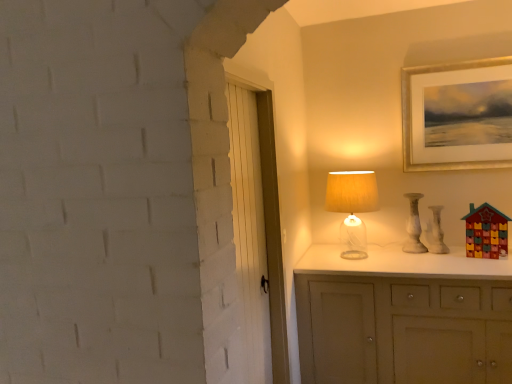
Locate an element on the screen. This screenshot has height=384, width=512. white painted wood door at center is located at coordinates (215, 137).

The image size is (512, 384). Describe the element at coordinates (436, 232) in the screenshot. I see `white marble vase at right` at that location.

You are a GUI agent. You are given a task and a screenshot of the screen. Output one action in this format:
    pyautogui.click(x=<x>, y=<y>)
    Task: Click on the wooden toy house at right
    The width and height of the screenshot is (512, 384).
    Given the screenshot: What is the action you would take?
    pyautogui.click(x=486, y=232)

What is the approximate width of gold-framed picture at upper right?

gold-framed picture at upper right is 2.23 inches wide.

I want to click on gold-framed picture at upper right, so click(458, 115).

Locate an element on the screen. The image size is (512, 384). translucent glass table lamp at upper right is located at coordinates (352, 207).

Locate an element on the screen. The width and height of the screenshot is (512, 384). white marble vase at right is located at coordinates (414, 226).

At what (x,y) coordinates should I click in order to perform the action: click on white painted wood door at center. Please return your answer as a coordinate pair (x, y). Looking at the image, I should click on (215, 137).

Is gold-framed picture at upper right inside or outside of wooden toy house at right?

gold-framed picture at upper right exists outside the volume of wooden toy house at right.

Is gold-framed picture at upper right oriented towards wooden toy house at right?

No, gold-framed picture at upper right is not facing towards wooden toy house at right.

Considering the positions of objects gold-framed picture at upper right and wooden toy house at right in the image provided, who is more to the right, gold-framed picture at upper right or wooden toy house at right?

wooden toy house at right.

How many degrees apart are the facing directions of gold-framed picture at upper right and wooden toy house at right?

The angle between the facing direction of gold-framed picture at upper right and the facing direction of wooden toy house at right is 13.4 degrees.

From a real-world perspective, who is located higher, white marble vase at right or wooden toy house at right?

white marble vase at right.

Is white marble vase at right directly adjacent to wooden toy house at right?

No, white marble vase at right is not beside wooden toy house at right.

Between white marble vase at right and wooden toy house at right, which one has smaller width?

Thinner between the two is wooden toy house at right.

Is white marble vase at right not within wooden toy house at right?

Absolutely, white marble vase at right is external to wooden toy house at right.

This screenshot has width=512, height=384. Identify the location of table lamp positioned vertically above the white marble vase at right (from a real-world perspective). (352, 207).

Which is in front, point (361, 241) or point (432, 208)?

The point (432, 208) is more forward.

From the image's perspective, which one is positioned higher, translucent glass table lamp at upper right or white marble vase at right?

translucent glass table lamp at upper right.

Is translucent glass table lamp at upper right oriented towards white marble vase at right?

No, translucent glass table lamp at upper right is not turned towards white marble vase at right.

Is white painted wood door at center at the left side of translucent glass table lamp at upper right?

Correct, you'll find white painted wood door at center to the left of translucent glass table lamp at upper right.

Is white painted wood door at center not inside translucent glass table lamp at upper right?

Yes, white painted wood door at center is outside of translucent glass table lamp at upper right.

How different are the orientations of white painted wood door at center and translucent glass table lamp at upper right in degrees?

89.7 degrees.

Can you confirm if white painted wood door at center is taller than translucent glass table lamp at upper right?

Indeed, white painted wood door at center has a greater height compared to translucent glass table lamp at upper right.

Considering the relative positions of white painted wood door at center and white marble vase at right in the image provided, is white painted wood door at center to the left of white marble vase at right from the viewer's perspective?

Correct, you'll find white painted wood door at center to the left of white marble vase at right.

From the image's perspective, between white painted wood door at center and white marble vase at right, which one is located above?

From the image's view, white marble vase at right is above.

Is point (196, 36) closer or farther from the camera than point (430, 206)?

Point (196, 36).

From the picture: Is wooden toy house at right taller than white painted wood door at center?

No.

Does wooden toy house at right appear on the left side of white painted wood door at center?

No, wooden toy house at right is not to the left of white painted wood door at center.

Based on the photo, from a real-world perspective, which is physically below, wooden toy house at right or white painted wood door at center?

wooden toy house at right.

Is translucent glass table lamp at upper right not close to white marble vase at right?

No, translucent glass table lamp at upper right is in close proximity to white marble vase at right.

Considering the relative sizes of translucent glass table lamp at upper right and white marble vase at right in the image provided, is translucent glass table lamp at upper right shorter than white marble vase at right?

In fact, translucent glass table lamp at upper right may be taller than white marble vase at right.

How many degrees apart are the facing directions of translucent glass table lamp at upper right and white marble vase at right?

They differ by 1.42 degrees in their facing directions.

From a real-world perspective, is translucent glass table lamp at upper right below white marble vase at right?

No.

At what (x,y) coordinates should I click in order to perform the action: click on toy in front of the gold-framed picture at upper right. Please return your answer as a coordinate pair (x, y). This screenshot has height=384, width=512. Looking at the image, I should click on (486, 232).

Where is `toy below the white marble vase at right (from a real-world perspective)`? This screenshot has width=512, height=384. toy below the white marble vase at right (from a real-world perspective) is located at coordinates 486,232.

Looking at this image, from the image, which object appears to be farther from white painted wood door at center, white marble vase at right or gold-framed picture at upper right?

white marble vase at right lies further to white painted wood door at center than the other object.

In the scene shown: When comparing their distances from white marble vase at right, does white painted wood door at center or gold-framed picture at upper right seem closer?

gold-framed picture at upper right lies closer to white marble vase at right than the other object.

Estimate the real-world distances between objects in this image. Which object is closer to translucent glass table lamp at upper right, wooden toy house at right or white marble vase at right?

white marble vase at right.

Estimate the real-world distances between objects in this image. Which object is closer to white painted wood door at center, gold-framed picture at upper right or wooden toy house at right?

The object closer to white painted wood door at center is wooden toy house at right.

Considering their positions, is translucent glass table lamp at upper right positioned closer to white marble vase at right than white painted wood door at center?

translucent glass table lamp at upper right lies closer to white marble vase at right than the other object.

From the picture: When comparing their distances from gold-framed picture at upper right, does wooden toy house at right or white marble vase at right seem closer?

white marble vase at right lies closer to gold-framed picture at upper right than the other object.

Considering their positions, is white painted wood door at center positioned further to white marble vase at right than gold-framed picture at upper right?

Among the two, white painted wood door at center is located further to white marble vase at right.

Looking at the image, which one is located closer to white painted wood door at center, wooden toy house at right or white marble vase at right?

Among the two, wooden toy house at right is located nearer to white painted wood door at center.

The height and width of the screenshot is (384, 512). I want to click on table lamp between white painted wood door at center and white marble vase at right in the front-back direction, so click(x=352, y=207).

Identify the location of picture frame located between translucent glass table lamp at upper right and wooden toy house at right in the left-right direction. (458, 115).

Locate an element on the screen. The height and width of the screenshot is (384, 512). table lamp that lies between gold-framed picture at upper right and white marble vase at right from top to bottom is located at coordinates (352, 207).

The image size is (512, 384). Find the location of `lamp located between translucent glass table lamp at upper right and white marble vase at right in the left-right direction`. lamp located between translucent glass table lamp at upper right and white marble vase at right in the left-right direction is located at coordinates (414, 226).